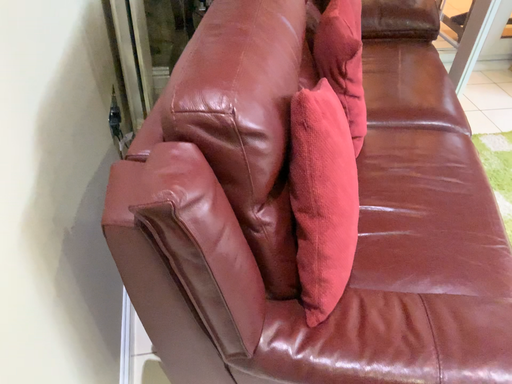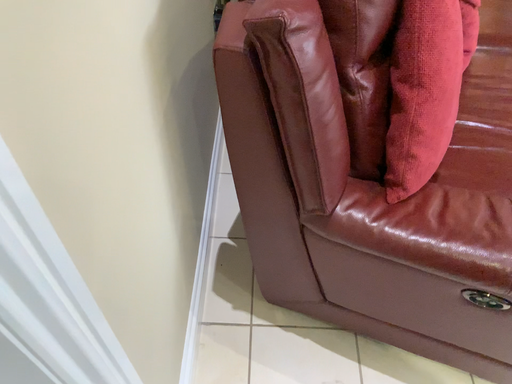
Question: How did the camera likely rotate when shooting the video?

Choices:
 (A) rotated right
 (B) rotated left

Answer: (B)